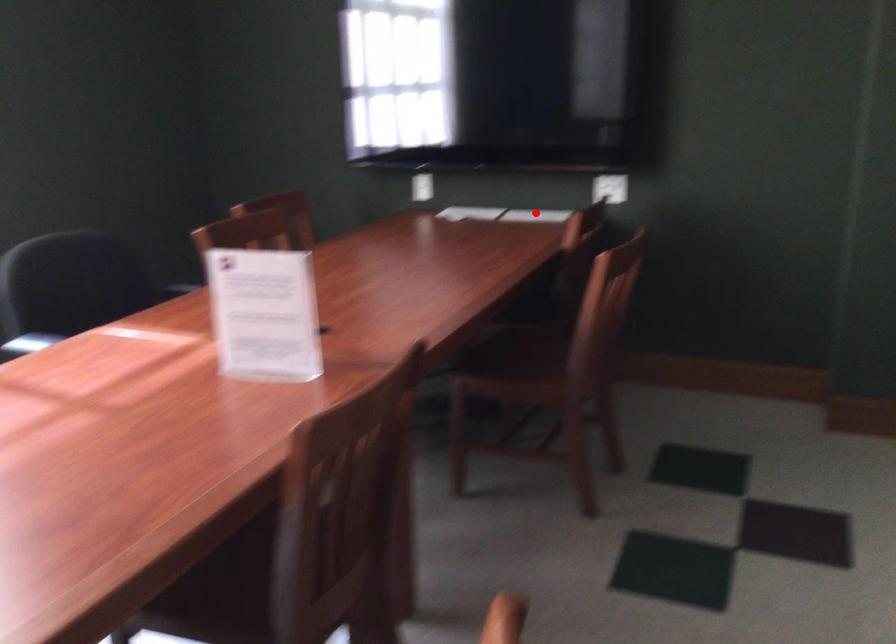
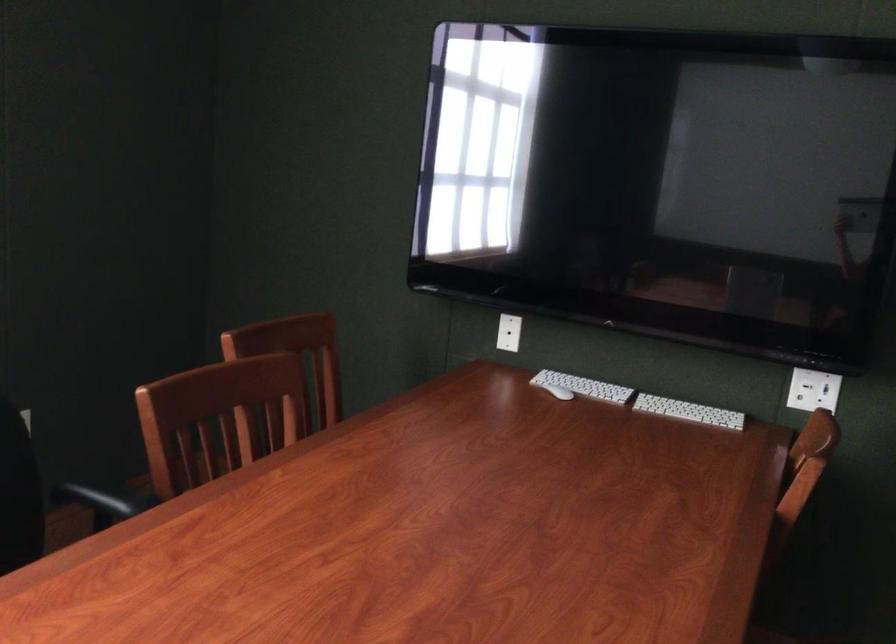
Locate, in the second image, the point that corresponds to the highlighted location in the first image.

(688, 412)